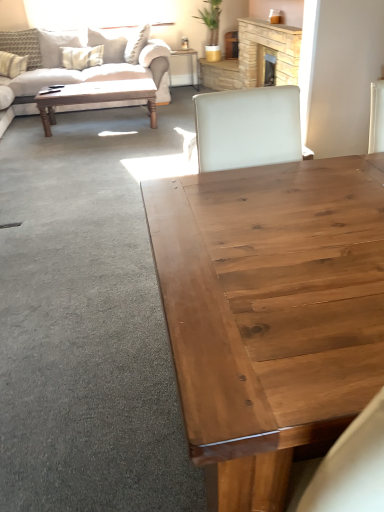
Question: From a real-world perspective, relative to wooden desk at center, is stone fireplace at upper center vertically above or below?

Choices:
 (A) below
 (B) above

Answer: (B)

Question: Looking at the image, does stone fireplace at upper center seem bigger or smaller compared to wooden desk at center?

Choices:
 (A) small
 (B) big

Answer: (B)

Question: Estimate the real-world distances between objects in this image. Which object is closer to the stone fireplace at upper center?

Choices:
 (A) patterned fabric pillow at upper left, which is counted as the 2th pillow, starting from the left
 (B) wooden desk at center
 (C) beige fabric pillow at upper left, the third pillow when ordered from right to left
 (D) wooden polished coffee table at upper left, placed as the 2th coffee table when sorted from right to left
 (E) beige fabric couch at upper left

Answer: (D)

Question: Considering the real-world distances, which object is closest to the beige fabric pillow at upper left, the 1th pillow viewed from the left?

Choices:
 (A) beige fabric couch at upper left
 (B) patterned fabric pillow at upper left, which appears as the second pillow when viewed from the right
 (C) white textured pillow at upper left, which ranks as the 3th pillow in left-to-right order
 (D) wooden desk at center
 (E) natural wood coffee table at center, which ranks as the first coffee table in bottom-to-top order

Answer: (B)